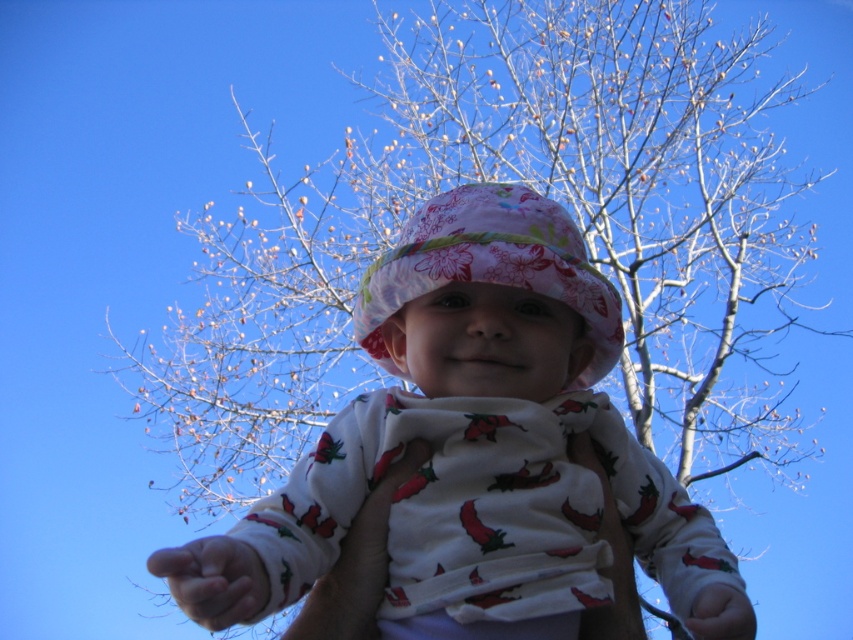
You are a photographer observing the baby in the image. You notice the floral fabric hat at center and the smooth skin hand at lower center. Which object is positioned higher in the image?

The floral fabric hat at center is above the smooth skin hand at lower center, so the floral fabric hat at center is positioned higher.

You are a photographer adjusting your camera to focus on two specific points in the image. The first point is at coordinates point (538, 237) and the second is at point (248, 595). Which point is closer to your camera lens?

Point (538, 237) is further to the viewer than point (248, 595), so the second point at (248, 595) is closer to the camera lens.

You are a photographer who wants to focus on the floral fabric hat at center. What are the coordinates of the hat?

The coordinates of the floral fabric hat at center are at point (490, 266).